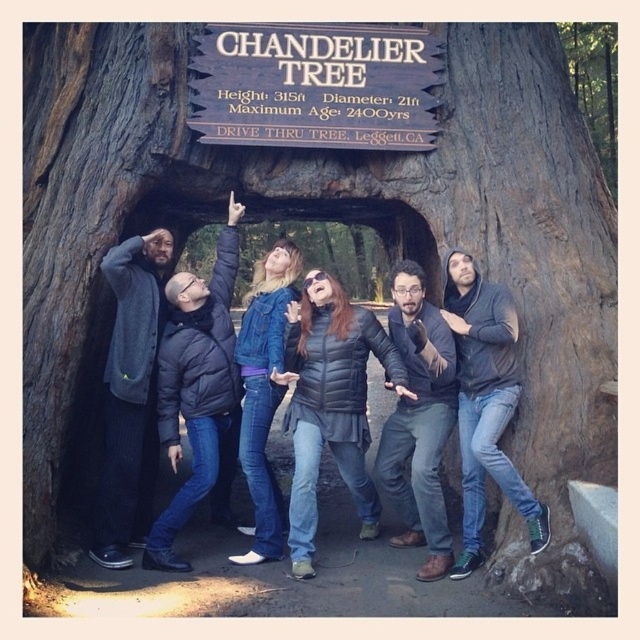
Which is more to the right, black puffer jacket at upper left or dark gray puffer jacket at center?

Positioned to the right is dark gray puffer jacket at center.

In the scene shown: Which is more to the left, black puffer jacket at upper left or dark gray puffer jacket at center?

black puffer jacket at upper left

Which is behind, point (225, 481) or point (452, 384)?

Positioned behind is point (225, 481).

I want to click on black puffer jacket at upper left, so click(x=196, y=387).

Is wooden sign at upper center shorter than matte black jacket at center?

Yes, wooden sign at upper center is shorter than matte black jacket at center.

Which is more to the right, wooden sign at upper center or matte black jacket at center?

From the viewer's perspective, matte black jacket at center appears more on the right side.

What are the coordinates of `wooden sign at upper center` in the screenshot? It's located at (316, 84).

Where is `black puffer jacket at upper left`? black puffer jacket at upper left is located at coordinates (196, 387).

Is black puffer jacket at upper left to the left of dark gray hoodie at center from the viewer's perspective?

Yes, black puffer jacket at upper left is to the left of dark gray hoodie at center.

Where is `black puffer jacket at upper left`? black puffer jacket at upper left is located at coordinates (196, 387).

Where is `black puffer jacket at upper left`? black puffer jacket at upper left is located at coordinates (196, 387).